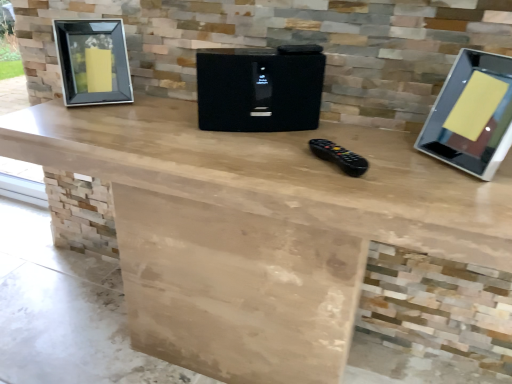
Image resolution: width=512 pixels, height=384 pixels. What are the coordinates of `vacant space underneath black glass picture frame at left (from a real-world perspective)` in the screenshot? It's located at pyautogui.click(x=108, y=293).